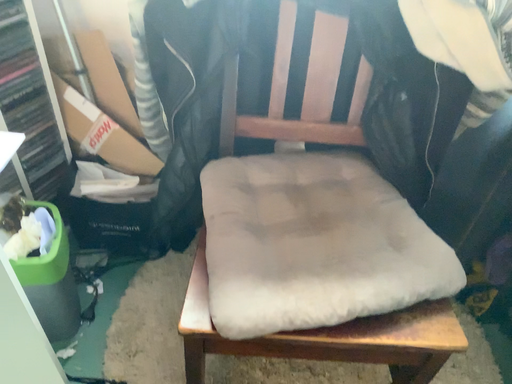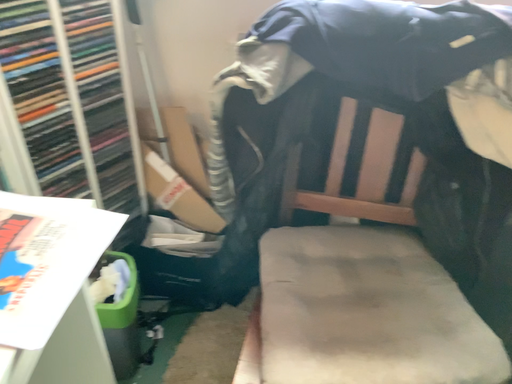
Question: Which way did the camera rotate in the video?

Choices:
 (A) rotated right
 (B) rotated left

Answer: (B)